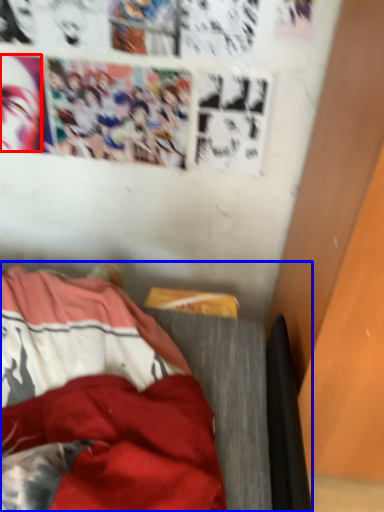
Question: Which point is closer to the camera, human face (highlighted by a red box) or furniture (highlighted by a blue box)?

Choices:
 (A) human face
 (B) furniture

Answer: (B)